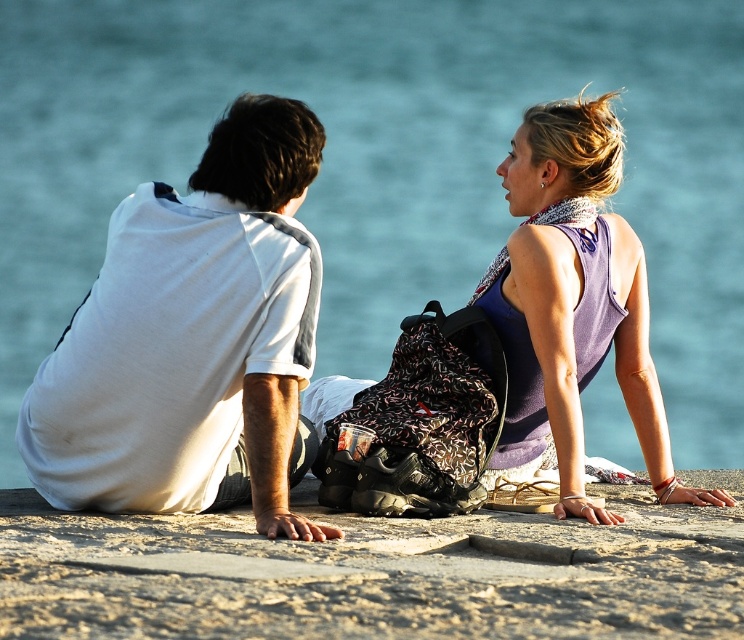
You are planning to place a picnic basket between the smooth concrete surface at center and the white cotton shirt at left. Given that the basket requires 6 feet of space, will there be enough room?

The smooth concrete surface at center and the white cotton shirt at left are 7.02 feet apart, so placing a picnic basket requiring 6 feet of space between them will be sufficient as the distance is greater than the required space.

You are planning to place a small picnic basket on the smooth concrete surface at center. Considering the size of the surface compared to the white cotton shirt at left, do you think the basket will fit comfortably?

The smooth concrete surface at center occupies less space than the white cotton shirt at left, so the basket may not fit comfortably as the surface is smaller than the shirt.

You are a photographer setting up a tripod to capture the scene. The smooth concrete surface at center and the purple fabric tank top at upper right are in your view. Which object is lower in height?

The smooth concrete surface at center has a lesser height compared to the purple fabric tank top at upper right, so the smooth concrete surface at center is lower in height.